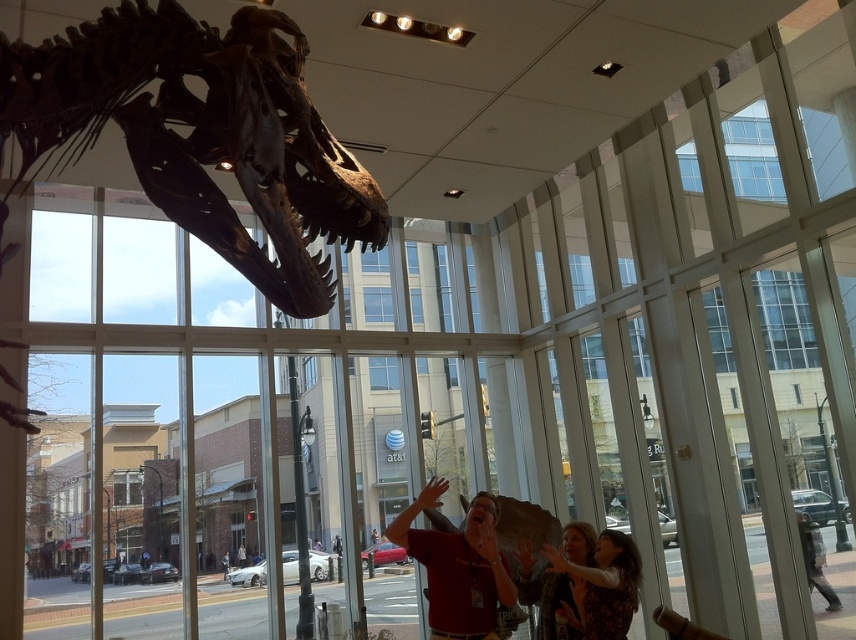
Question: Which point appears closest to the camera in this image?

Choices:
 (A) (72, 150)
 (B) (492, 528)
 (C) (797, 525)
 (D) (522, 544)

Answer: (A)

Question: Which of these objects is positioned farthest from the brown matte skull at upper center?

Choices:
 (A) matte red shirt at center
 (B) matte brown hair at lower right
 (C) matte black shirt at center
 (D) dark gray jacket at lower right

Answer: (D)

Question: Can you confirm if matte black shirt at center is positioned below dark gray jacket at lower right?

Choices:
 (A) no
 (B) yes

Answer: (A)

Question: Can you confirm if matte red shirt at center is positioned to the right of matte black shirt at center?

Choices:
 (A) yes
 (B) no

Answer: (B)

Question: Which is farther from the dark gray jacket at lower right?

Choices:
 (A) brown matte skull at upper center
 (B) matte red shirt at center
 (C) matte brown hair at lower right

Answer: (A)

Question: Does brown matte skull at upper center have a smaller size compared to matte black shirt at center?

Choices:
 (A) no
 (B) yes

Answer: (A)